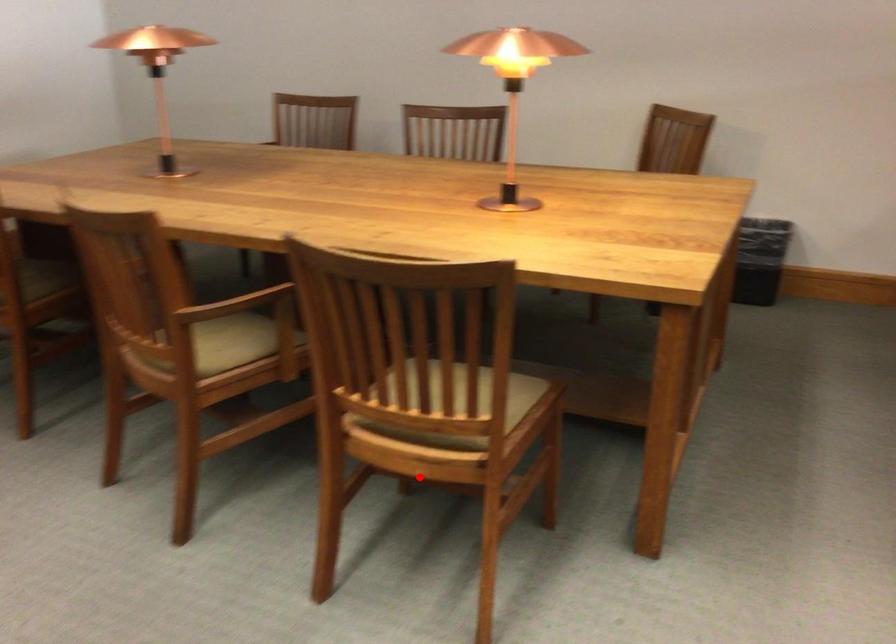
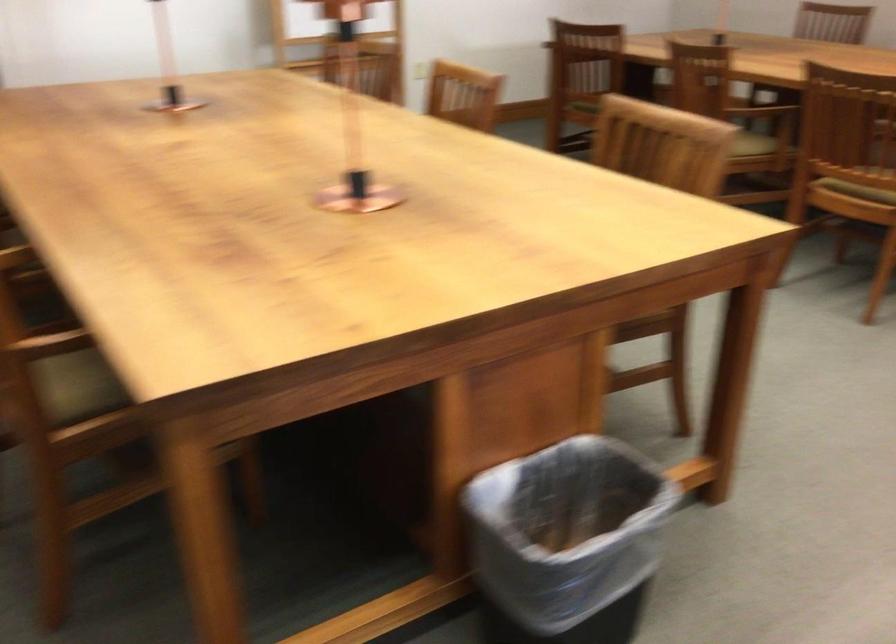
Question: I am providing you with two images of the same scene from different viewpoints. Image1 has a red point marked. In image2, the corresponding 3D location appears at what relative position? Reply with the corresponding letter.

Choices:
 (A) Closer
 (B) Farther

Answer: (B)